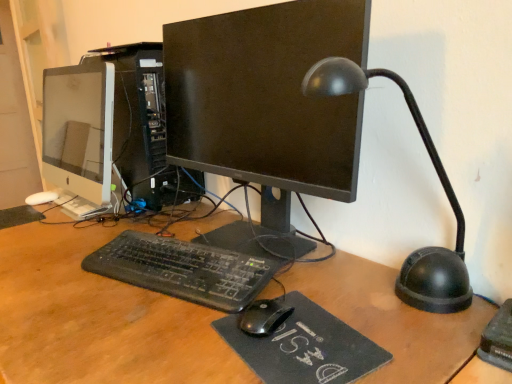
Image resolution: width=512 pixels, height=384 pixels. Describe the element at coordinates (79, 135) in the screenshot. I see `white glossy monitor at left, acting as the second computer monitor starting from the right` at that location.

Measure the distance between point (x=93, y=80) and camera.

Point (x=93, y=80) is 3.78 feet away from camera.

Measure the distance between point (x=273, y=83) and camera.

Point (x=273, y=83) and camera are 34.92 inches apart.

From the picture: What is the approximate width of black plastic table lamp at right?

12.37 inches.

Where is `black felt mousepad at center`? The height and width of the screenshot is (384, 512). black felt mousepad at center is located at coordinates (304, 347).

Considering the sizes of white glossy monitor at left, the first computer monitor in the left-to-right sequence, and satin black computer tower at center in the image, is white glossy monitor at left, the first computer monitor in the left-to-right sequence, taller or shorter than satin black computer tower at center?

white glossy monitor at left, the first computer monitor in the left-to-right sequence, is shorter than satin black computer tower at center.

Is white glossy monitor at left, acting as the second computer monitor starting from the right, facing towards satin black computer tower at center?

Yes, white glossy monitor at left, acting as the second computer monitor starting from the right, is aimed at satin black computer tower at center.

From the image's perspective, is white glossy monitor at left, the first computer monitor in the left-to-right sequence, located above or below satin black computer tower at center?

From the image's perspective, white glossy monitor at left, the first computer monitor in the left-to-right sequence, appears below satin black computer tower at center.

Measure the distance from white glossy monitor at left, acting as the second computer monitor starting from the right, to satin black computer tower at center.

They are 5.80 inches apart.

From the image's perspective, would you say black felt mousepad at center is shown under black plastic keyboard at center?

Yes, from the image's perspective, black felt mousepad at center is beneath black plastic keyboard at center.

Is black plastic keyboard at center surrounded by black felt mousepad at center?

No, black plastic keyboard at center is not surrounded by black felt mousepad at center.

Is black plastic keyboard at center at the back of black felt mousepad at center?

No, black plastic keyboard at center is not at the back of black felt mousepad at center.

Which object is positioned more to the right, black felt mousepad at center or black plastic keyboard at center?

From the viewer's perspective, black felt mousepad at center appears more on the right side.

Are black plastic table lamp at right and black matte monitor at center, which is counted as the 1th computer monitor, starting from the right, far apart?

black plastic table lamp at right is near black matte monitor at center, which is counted as the 1th computer monitor, starting from the right, not far away.

Does point (441, 166) appear closer or farther from the camera than point (289, 183)?

Point (441, 166) is positioned closer to the camera compared to point (289, 183).

From the picture: From a real-world perspective, is black plastic table lamp at right positioned above or below black matte monitor at center, which appears as the 2th computer monitor when viewed from the left?

Clearly, from a real-world perspective, black plastic table lamp at right is below black matte monitor at center, which appears as the 2th computer monitor when viewed from the left.

Based on the photo, considering the sizes of black plastic table lamp at right and black matte monitor at center, which appears as the 2th computer monitor when viewed from the left, in the image, is black plastic table lamp at right wider or thinner than black matte monitor at center, which appears as the 2th computer monitor when viewed from the left,?

black plastic table lamp at right is wider than black matte monitor at center, which appears as the 2th computer monitor when viewed from the left.

Is black plastic table lamp at right oriented towards black felt mousepad at center?

Yes, black plastic table lamp at right is turned towards black felt mousepad at center.

Considering the positions of objects black plastic table lamp at right and black felt mousepad at center in the image provided, who is more to the right, black plastic table lamp at right or black felt mousepad at center?

black plastic table lamp at right is more to the right.

In the scene shown: Choose the correct answer: Is black plastic table lamp at right inside black felt mousepad at center or outside it?

black plastic table lamp at right is not inside black felt mousepad at center, it's outside.

From a real-world perspective, does black plastic table lamp at right stand above black felt mousepad at center?

Yes, from a real-world perspective, black plastic table lamp at right is above black felt mousepad at center.

Does black plastic keyboard at center have a smaller size compared to white glossy monitor at left, acting as the second computer monitor starting from the right?

Yes, black plastic keyboard at center is smaller than white glossy monitor at left, acting as the second computer monitor starting from the right.

Is point (147, 262) in front of point (74, 214)?

Yes, point (147, 262) is closer to viewer.

Is black plastic keyboard at center surrounding white glossy monitor at left, the first computer monitor in the left-to-right sequence?

No.

Between black plastic keyboard at center and white glossy monitor at left, the first computer monitor in the left-to-right sequence, which one appears on the right side from the viewer's perspective?

Positioned to the right is black plastic keyboard at center.

Considering the relative sizes of white glossy monitor at left, acting as the second computer monitor starting from the right, and black felt mousepad at center in the image provided, is white glossy monitor at left, acting as the second computer monitor starting from the right, taller than black felt mousepad at center?

Yes.

From the image's perspective, is white glossy monitor at left, acting as the second computer monitor starting from the right, located above or below black felt mousepad at center?

Clearly, from the image's perspective, white glossy monitor at left, acting as the second computer monitor starting from the right, is above black felt mousepad at center.

From a real-world perspective, which is physically below, white glossy monitor at left, the first computer monitor in the left-to-right sequence, or black felt mousepad at center?

black felt mousepad at center is physically lower.

Considering the positions of objects white glossy monitor at left, the first computer monitor in the left-to-right sequence, and black felt mousepad at center in the image provided, who is more to the left, white glossy monitor at left, the first computer monitor in the left-to-right sequence, or black felt mousepad at center?

white glossy monitor at left, the first computer monitor in the left-to-right sequence.

Which is more to the left, black matte monitor at center, which is counted as the 1th computer monitor, starting from the right, or satin black computer tower at center?

satin black computer tower at center is more to the left.

What's the angular difference between black matte monitor at center, which appears as the 2th computer monitor when viewed from the left, and satin black computer tower at center's facing directions?

The angular difference between black matte monitor at center, which appears as the 2th computer monitor when viewed from the left, and satin black computer tower at center is 1.14 degrees.

I want to click on computer tower on the left of black matte monitor at center, which appears as the 2th computer monitor when viewed from the left, so click(142, 125).

From the image's perspective, is black matte monitor at center, which is counted as the 1th computer monitor, starting from the right, under satin black computer tower at center?

Indeed, from the image's perspective, black matte monitor at center, which is counted as the 1th computer monitor, starting from the right, is shown beneath satin black computer tower at center.

Identify the location of the 1st computer monitor in front of the satin black computer tower at center. Image resolution: width=512 pixels, height=384 pixels. (79, 135).

At what (x,y) coordinates should I click in order to perform the action: click on mousepad that appears on the right of black plastic keyboard at center. Please return your answer as a coordinate pair (x, y). Looking at the image, I should click on (304, 347).

Considering their positions, is black plastic table lamp at right positioned further to black plastic keyboard at center than black felt mousepad at center?

The object further to black plastic keyboard at center is black plastic table lamp at right.

Estimate the real-world distances between objects in this image. Which object is closer to black felt mousepad at center, white glossy monitor at left, acting as the second computer monitor starting from the right, or black plastic keyboard at center?

black plastic keyboard at center.

In the scene shown: Estimate the real-world distances between objects in this image. Which object is closer to black plastic keyboard at center, satin black computer tower at center or white glossy monitor at left, the first computer monitor in the left-to-right sequence?

satin black computer tower at center.

From the image, which object appears to be nearer to black matte monitor at center, which appears as the 2th computer monitor when viewed from the left, black felt mousepad at center or black plastic keyboard at center?

black plastic keyboard at center is closer to black matte monitor at center, which appears as the 2th computer monitor when viewed from the left.

From the image, which object appears to be farther from black plastic keyboard at center, black matte monitor at center, which is counted as the 1th computer monitor, starting from the right, or satin black computer tower at center?

Among the two, satin black computer tower at center is located further to black plastic keyboard at center.

Considering their positions, is black matte monitor at center, which appears as the 2th computer monitor when viewed from the left, positioned further to white glossy monitor at left, the first computer monitor in the left-to-right sequence, than black plastic keyboard at center?

black plastic keyboard at center is positioned further to the anchor white glossy monitor at left, the first computer monitor in the left-to-right sequence.

Looking at this image, from the image, which object appears to be nearer to satin black computer tower at center, black matte monitor at center, which is counted as the 1th computer monitor, starting from the right, or black plastic table lamp at right?

black matte monitor at center, which is counted as the 1th computer monitor, starting from the right.

Consider the image. Considering their positions, is black plastic table lamp at right positioned further to black plastic keyboard at center than black matte monitor at center, which is counted as the 1th computer monitor, starting from the right?

black plastic table lamp at right lies further to black plastic keyboard at center than the other object.

I want to click on mousepad situated between black plastic keyboard at center and black plastic table lamp at right from left to right, so click(304, 347).

Where is `computer monitor located between white glossy monitor at left, the first computer monitor in the left-to-right sequence, and black felt mousepad at center in the left-right direction`? computer monitor located between white glossy monitor at left, the first computer monitor in the left-to-right sequence, and black felt mousepad at center in the left-right direction is located at coordinates (266, 109).

This screenshot has width=512, height=384. In order to click on computer tower situated between white glossy monitor at left, the first computer monitor in the left-to-right sequence, and black plastic table lamp at right from left to right in this screenshot , I will do (142, 125).

Find the location of a particular element. The width and height of the screenshot is (512, 384). mousepad between black plastic table lamp at right and satin black computer tower at center in the front-back direction is located at coordinates tap(304, 347).